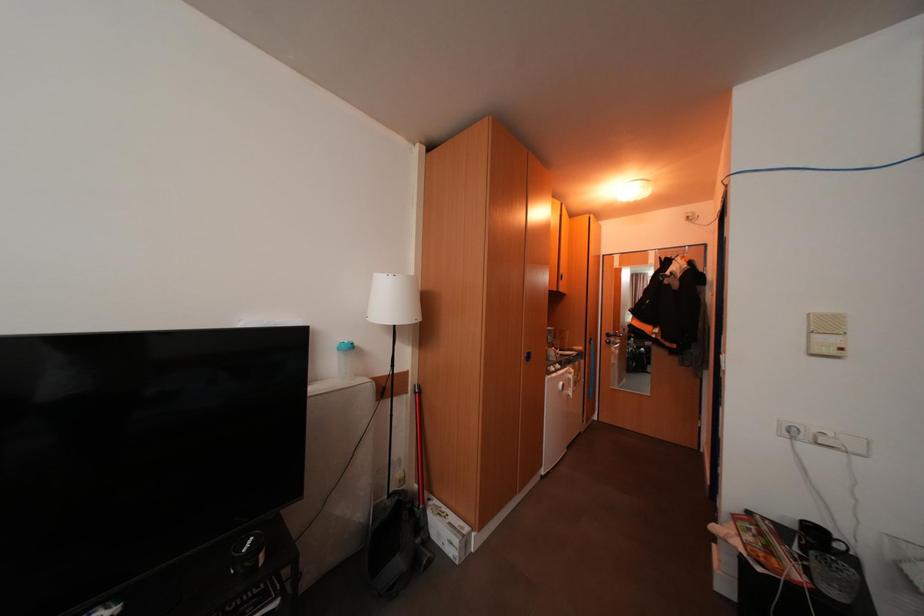
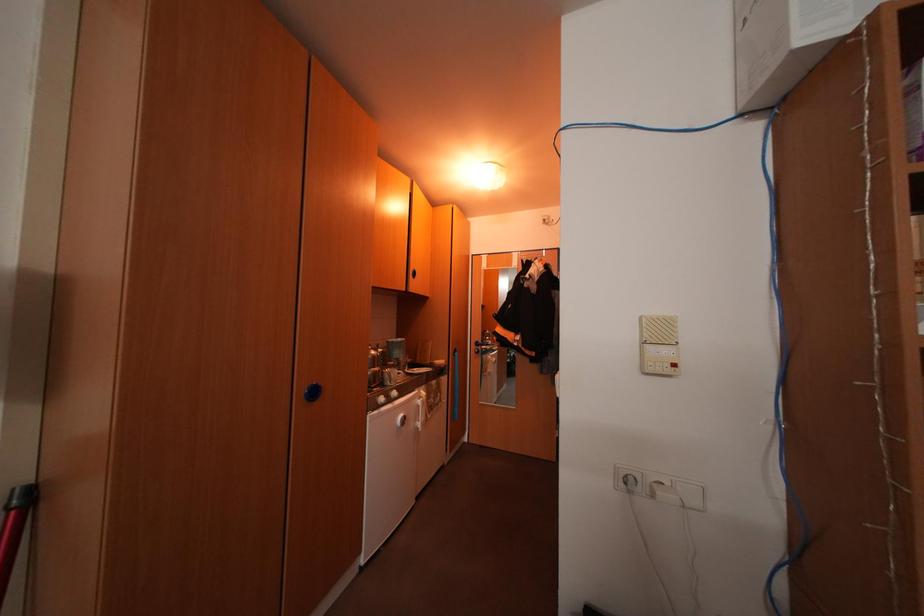
What movement of the cameraman would produce the second image?

The cameraman moved toward right, forward.